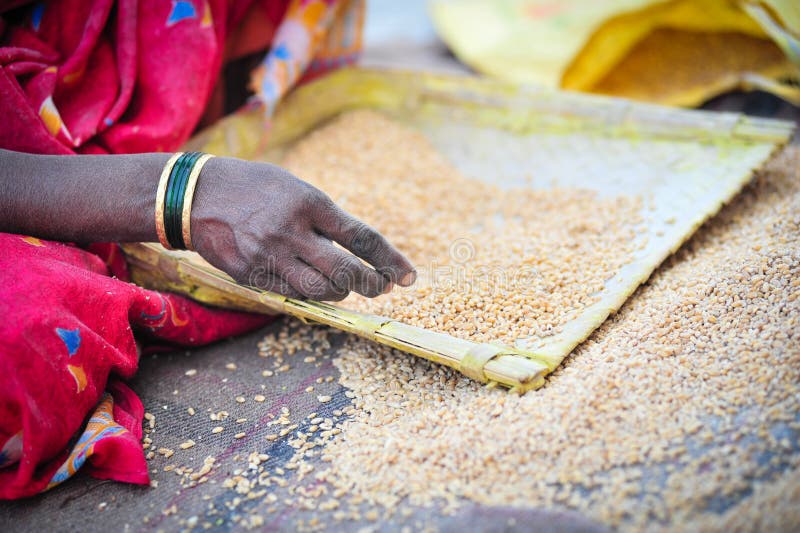
You are a GUI agent. You are given a task and a screenshot of the screen. Output one action in this format:
    pyautogui.click(x=<x>, y=<y>)
    Task: Click on the light brown bands around edge of tray
    
    Given the screenshot: What is the action you would take?
    pyautogui.click(x=490, y=356), pyautogui.click(x=366, y=323), pyautogui.click(x=265, y=303), pyautogui.click(x=170, y=260)